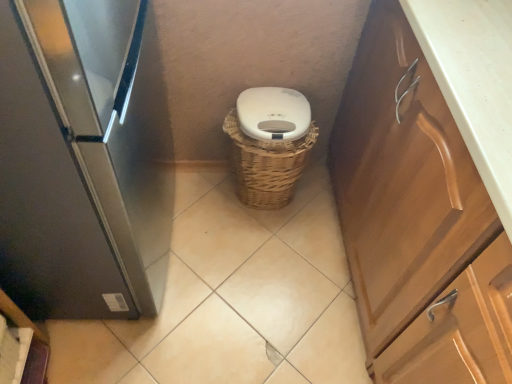
You are a GUI agent. You are given a task and a screenshot of the screen. Output one action in this format:
    pyautogui.click(x=<x>, y=<y>)
    Task: Click on the wooden cabinet at right
    This screenshot has height=384, width=512.
    Given the screenshot: What is the action you would take?
    pyautogui.click(x=417, y=220)

At what (x,y) coordinates should I click in order to perform the action: click on wooden cabinet at right. Please return your answer as a coordinate pair (x, y). This screenshot has height=384, width=512. Looking at the image, I should click on (417, 220).

Considering the sizes of objects white matte toilet bowl at center and woven brown basket at center in the image provided, who is smaller, white matte toilet bowl at center or woven brown basket at center?

With smaller size is white matte toilet bowl at center.

Are white matte toilet bowl at center and woven brown basket at center beside each other?

No, white matte toilet bowl at center is not next to woven brown basket at center.

Who is taller, white matte toilet bowl at center or woven brown basket at center?

Standing taller between the two is white matte toilet bowl at center.

Would you say white matte toilet bowl at center is inside or outside satin black refrigerator at left?

white matte toilet bowl at center lies outside satin black refrigerator at left.

Where is `home appliance above the white matte toilet bowl at center (from a real-world perspective)`? The image size is (512, 384). home appliance above the white matte toilet bowl at center (from a real-world perspective) is located at coordinates (83, 159).

Who is taller, white matte toilet bowl at center or satin black refrigerator at left?

satin black refrigerator at left.

Does white matte toilet bowl at center have a larger size compared to satin black refrigerator at left?

No, white matte toilet bowl at center is not bigger than satin black refrigerator at left.

From the image's perspective, is satin black refrigerator at left under wooden cabinet at right?

No.

Considering the relative sizes of satin black refrigerator at left and wooden cabinet at right in the image provided, is satin black refrigerator at left wider than wooden cabinet at right?

No.

Can you confirm if satin black refrigerator at left is smaller than wooden cabinet at right?

Indeed, satin black refrigerator at left has a smaller size compared to wooden cabinet at right.

Is wooden cabinet at right at the back of satin black refrigerator at left?

satin black refrigerator at left is not turned away from wooden cabinet at right.

Can you confirm if white matte toilet bowl at center is wider than wooden cabinet at right?

No.

Which is less distant, (254, 93) or (330, 164)?

Point (254, 93).

From a real-world perspective, who is located lower, white matte toilet bowl at center or wooden cabinet at right?

white matte toilet bowl at center is physically lower.

From the image's perspective, between white matte toilet bowl at center and wooden cabinet at right, which one is located above?

white matte toilet bowl at center, from the image's perspective.

From the picture: From a real-world perspective, which is physically above, woven brown basket at center or wooden cabinet at right?

wooden cabinet at right is physically above.

Is woven brown basket at center inside the boundaries of wooden cabinet at right, or outside?

woven brown basket at center is not inside wooden cabinet at right, it's outside.

Would you consider woven brown basket at center to be distant from wooden cabinet at right?

They are positioned close to each other.

Considering the sizes of objects woven brown basket at center and wooden cabinet at right in the image provided, who is thinner, woven brown basket at center or wooden cabinet at right?

woven brown basket at center is thinner.

Between woven brown basket at center and woven brown basket at center, which one is positioned behind?

woven brown basket at center is more distant.

Locate an element on the screen. plain below the woven brown basket at center (from the image's perspective) is located at coordinates (233, 299).

Is woven brown basket at center wider than woven brown basket at center?

In fact, woven brown basket at center might be narrower than woven brown basket at center.

Is woven brown basket at center situated inside woven brown basket at center or outside?

woven brown basket at center exists outside the volume of woven brown basket at center.

Who is more distant, wooden cabinet at right or woven brown basket at center?

woven brown basket at center is more distant.

Do you think wooden cabinet at right is within woven brown basket at center, or outside of it?

wooden cabinet at right is not inside woven brown basket at center, it's outside.

Visually, is wooden cabinet at right positioned to the left or to the right of woven brown basket at center?

Clearly, wooden cabinet at right is on the right of woven brown basket at center in the image.

Considering the relative sizes of wooden cabinet at right and woven brown basket at center in the image provided, is wooden cabinet at right thinner than woven brown basket at center?

Yes, wooden cabinet at right is thinner than woven brown basket at center.

The width and height of the screenshot is (512, 384). In order to click on plain directly beneath the white matte toilet bowl at center (from a real-world perspective) in this screenshot , I will do (x=233, y=299).

Locate an element on the screen. toilet bowl that is behind the satin black refrigerator at left is located at coordinates (273, 113).

When comparing their distances from satin black refrigerator at left, does wooden cabinet at right or woven brown basket at center seem closer?

The object closer to satin black refrigerator at left is woven brown basket at center.

Based on their spatial positions, is woven brown basket at center or white matte toilet bowl at center closer to woven brown basket at center?

Among the two, woven brown basket at center is located nearer to woven brown basket at center.

Based on their spatial positions, is white matte toilet bowl at center or wooden cabinet at right further from woven brown basket at center?

Based on the image, white matte toilet bowl at center appears to be further to woven brown basket at center.

When comparing their distances from white matte toilet bowl at center, does woven brown basket at center or wooden cabinet at right seem further?

The object further to white matte toilet bowl at center is wooden cabinet at right.

When comparing their distances from woven brown basket at center, does white matte toilet bowl at center or satin black refrigerator at left seem further?

The object further to woven brown basket at center is satin black refrigerator at left.

Based on their spatial positions, is white matte toilet bowl at center or woven brown basket at center further from woven brown basket at center?

The object further to woven brown basket at center is white matte toilet bowl at center.

From the image, which object appears to be farther from woven brown basket at center, woven brown basket at center or satin black refrigerator at left?

satin black refrigerator at left lies further to woven brown basket at center than the other object.

Considering their positions, is woven brown basket at center positioned closer to white matte toilet bowl at center than wooden cabinet at right?

wooden cabinet at right.

You are a GUI agent. You are given a task and a screenshot of the screen. Output one action in this format:
    pyautogui.click(x=<x>, y=<y>)
    Task: Click on the plain between satin black refrigerator at left and woven brown basket at center along the z-axis
    
    Given the screenshot: What is the action you would take?
    pyautogui.click(x=233, y=299)

The width and height of the screenshot is (512, 384). Find the location of `plain situated between satin black refrigerator at left and wooden cabinet at right from left to right`. plain situated between satin black refrigerator at left and wooden cabinet at right from left to right is located at coordinates (233, 299).

This screenshot has width=512, height=384. Identify the location of plain positioned between satin black refrigerator at left and white matte toilet bowl at center from near to far. (233, 299).

Locate an element on the screen. The width and height of the screenshot is (512, 384). basket between white matte toilet bowl at center and woven brown basket at center in the up-down direction is located at coordinates (267, 165).